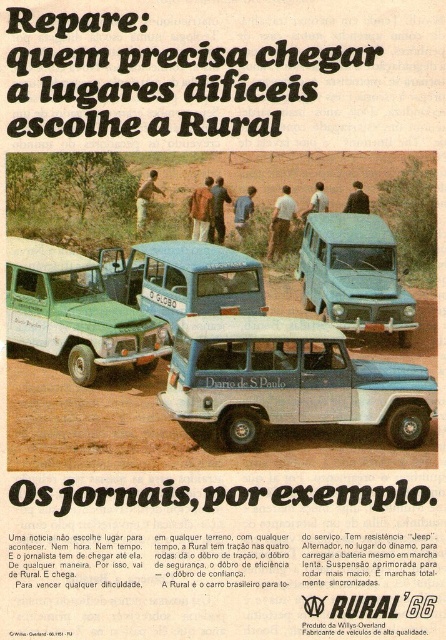
Does blue matte van at center have a lesser height compared to dark brown leather jacket at center?

Incorrect, blue matte van at center's height does not fall short of dark brown leather jacket at center's.

Find the location of `blue matte van at center`. blue matte van at center is located at coordinates (184, 280).

Where is `blue matte van at center`? blue matte van at center is located at coordinates (184, 280).

Can you confirm if blue matte van at center is taller than blue fabric shirt at center?

Yes, blue matte van at center is taller than blue fabric shirt at center.

Is blue matte van at center further to camera compared to blue fabric shirt at center?

That is False.

Identify the location of blue matte van at center. The height and width of the screenshot is (640, 446). (184, 280).

This screenshot has height=640, width=446. What are the coordinates of `blue matte van at center` in the screenshot? It's located at (184, 280).

Which is more to the right, light brown leather jacket at center or white plastic license plate at center?

From the viewer's perspective, light brown leather jacket at center appears more on the right side.

Is light brown leather jacket at center above white plastic license plate at center?

Yes.

Is point (201, 212) behind point (172, 298)?

Yes, it is behind point (172, 298).

The image size is (446, 640). I want to click on light brown leather jacket at center, so click(x=202, y=211).